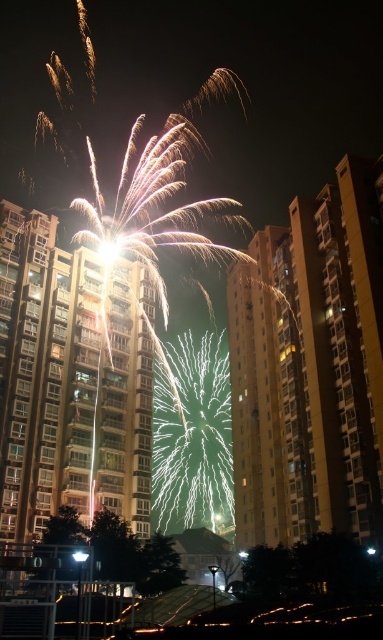
Question: Is bright white sparkler at center to the right of white glass streetlight at center from the viewer's perspective?

Choices:
 (A) yes
 (B) no

Answer: (B)

Question: Which object is closer to the camera taking this photo?

Choices:
 (A) bright white sparkler at center
 (B) white glass streetlight at center

Answer: (B)

Question: In this image, where is bright white sparkler at center located relative to white glass streetlight at center?

Choices:
 (A) right
 (B) left

Answer: (B)

Question: Does bright white sparkler at center appear under white glass streetlight at center?

Choices:
 (A) no
 (B) yes

Answer: (A)

Question: Which object is farther from the camera taking this photo?

Choices:
 (A) white glass streetlight at center
 (B) bright white sparkler at center

Answer: (B)